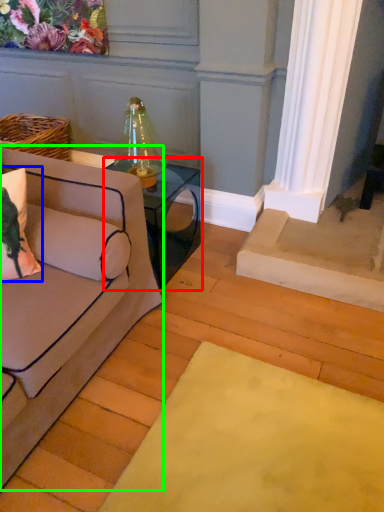
Question: Considering the real-world distances, which object is closest to table (highlighted by a red box)? pillow (highlighted by a blue box) or studio couch (highlighted by a green box).

Choices:
 (A) pillow
 (B) studio couch

Answer: (B)